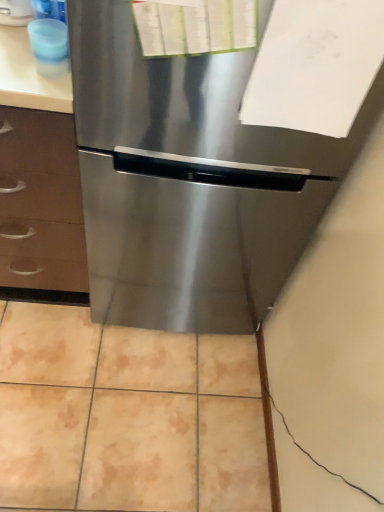
Find the location of a particular element. Image resolution: width=384 pixels, height=512 pixels. free space in front of stainless steel refrigerator at center is located at coordinates (138, 403).